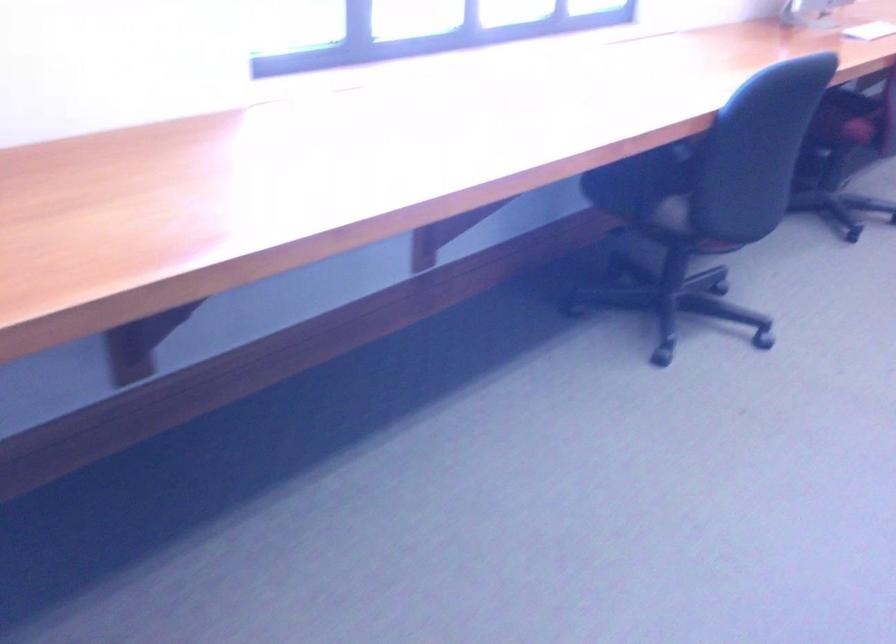
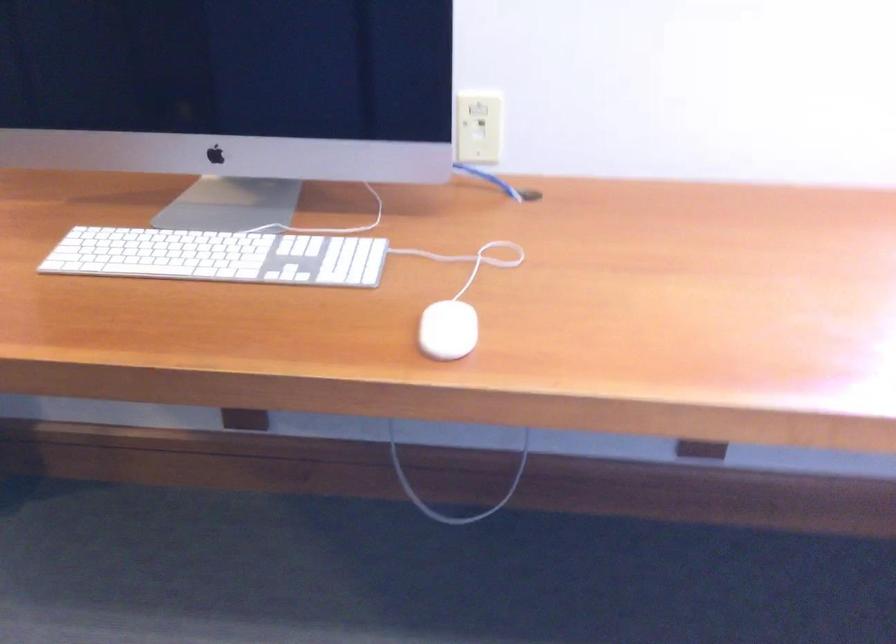
Question: The first image is from the beginning of the video and the second image is from the end. How did the camera likely rotate when shooting the video?

Choices:
 (A) Left
 (B) Right
 (C) Up
 (D) Down

Answer: (A)